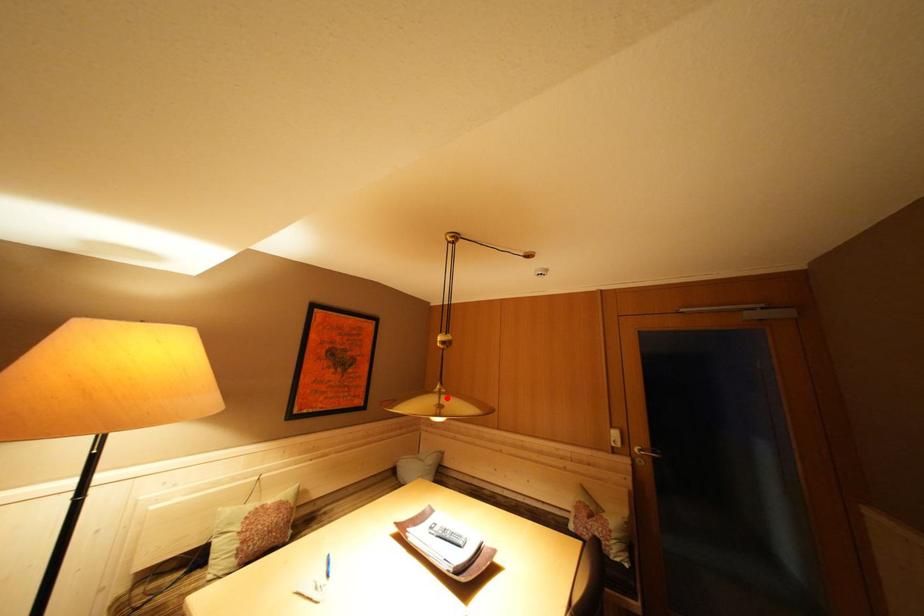
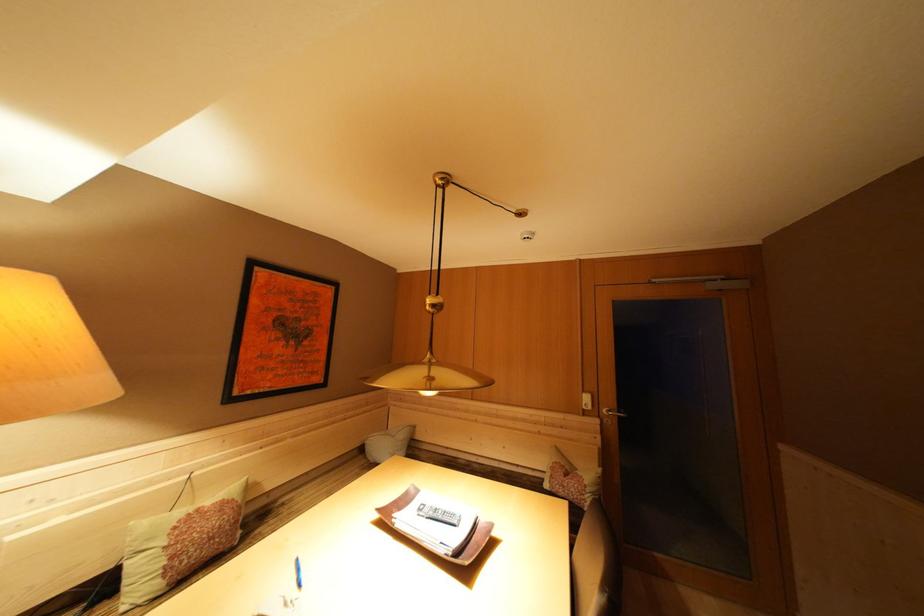
Question: I am providing you with two images of the same scene from different viewpoints. A red point is marked on the first image. At the location where the point appears in image 1, is it still visible in image 2?

Choices:
 (A) Yes
 (B) No

Answer: (A)